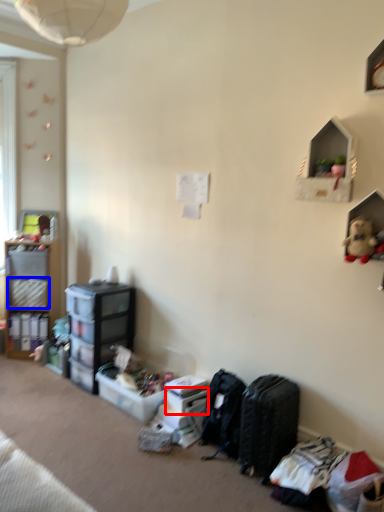
Question: Which point is further to the camera, storage box (highlighted by a red box) or storage box (highlighted by a blue box)?

Choices:
 (A) storage box
 (B) storage box

Answer: (B)